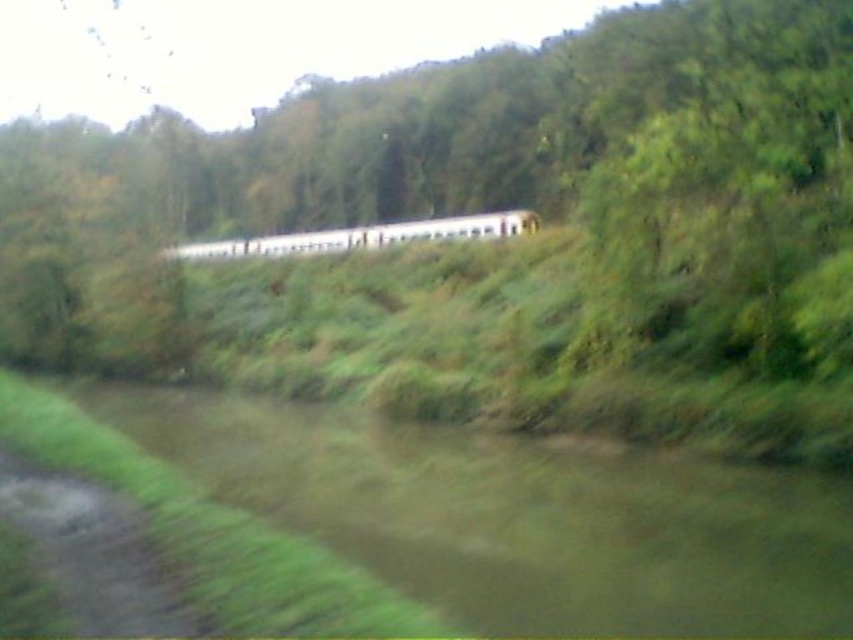
Can you confirm if brown muddy river at lower left is bigger than white matte passenger train at center?

Actually, brown muddy river at lower left might be smaller than white matte passenger train at center.

Between brown muddy river at lower left and white matte passenger train at center, which one has less height?

With less height is brown muddy river at lower left.

Which is behind, point (415, 509) or point (172, 250)?

Point (172, 250)

Locate an element on the screen. This screenshot has width=853, height=640. brown muddy river at lower left is located at coordinates (515, 515).